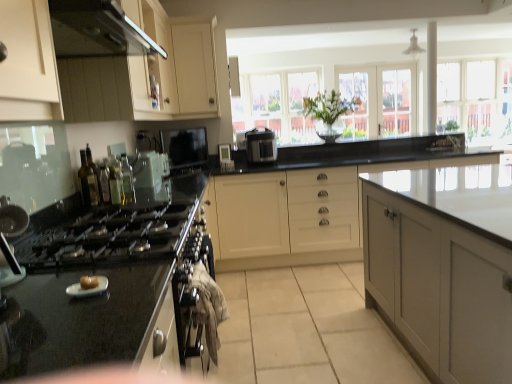
Question: Is black glossy stovetop at left taller than clear glass bottle at left, which ranks as the 3th bottle in front-to-back order?

Choices:
 (A) no
 (B) yes

Answer: (B)

Question: Considering the relative sizes of black glossy stovetop at left and clear glass bottle at left, arranged as the second bottle when viewed from the back, in the image provided, is black glossy stovetop at left smaller than clear glass bottle at left, arranged as the second bottle when viewed from the back,?

Choices:
 (A) yes
 (B) no

Answer: (B)

Question: Considering the relative sizes of black glossy stovetop at left and clear glass bottle at left, which ranks as the 3th bottle in front-to-back order, in the image provided, is black glossy stovetop at left shorter than clear glass bottle at left, which ranks as the 3th bottle in front-to-back order,?

Choices:
 (A) no
 (B) yes

Answer: (A)

Question: From the image's perspective, is black glossy stovetop at left located above clear glass bottle at left, arranged as the second bottle when viewed from the back?

Choices:
 (A) no
 (B) yes

Answer: (A)

Question: Is clear glass bottle at left, arranged as the second bottle when viewed from the back, at the back of black glossy stovetop at left?

Choices:
 (A) yes
 (B) no

Answer: (B)

Question: From a real-world perspective, is black glossy stovetop at left positioned under clear glass bottle at left, arranged as the second bottle when viewed from the back, based on gravity?

Choices:
 (A) no
 (B) yes

Answer: (B)

Question: Could you tell me if matte black sink at left, placed as the 1th appliance when sorted from bottom to top, is facing clear glass window at upper center, which appears as the 2th window screen when viewed from the left?

Choices:
 (A) yes
 (B) no

Answer: (B)

Question: Is matte black sink at left, the 3th appliance viewed from the top, positioned far away from clear glass window at upper center, which is counted as the first window screen, starting from the right?

Choices:
 (A) yes
 (B) no

Answer: (A)

Question: Is matte black sink at left, the 3th appliance viewed from the top, further to the viewer compared to clear glass window at upper center, which appears as the 2th window screen when viewed from the left?

Choices:
 (A) no
 (B) yes

Answer: (A)

Question: Is matte black sink at left, the second appliance viewed from the right, shorter than clear glass window at upper center, which appears as the 2th window screen when viewed from the left?

Choices:
 (A) yes
 (B) no

Answer: (A)

Question: Does matte black sink at left, the 1th appliance positioned from the front, appear on the left side of clear glass window at upper center, which is counted as the first window screen, starting from the right?

Choices:
 (A) no
 (B) yes

Answer: (B)

Question: Can you confirm if matte black sink at left, the 3th appliance viewed from the top, is positioned to the right of clear glass window at upper center, which appears as the 2th window screen when viewed from the left?

Choices:
 (A) yes
 (B) no

Answer: (B)

Question: Is white glossy digital clock at center, the 3th appliance positioned from the bottom, further to camera compared to satin black rice cooker at center?

Choices:
 (A) yes
 (B) no

Answer: (A)